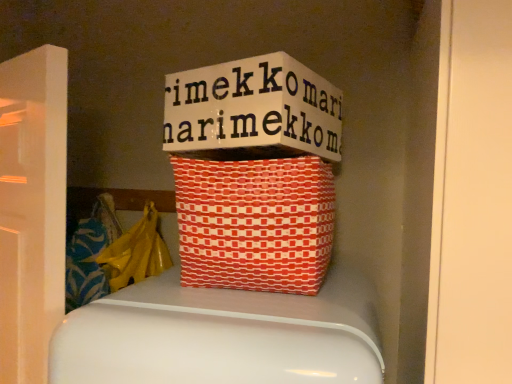
Measure the distance between yellow plastic bag at left and camera.

They are 1.14 meters apart.

Where is `yellow plastic bag at left`? This screenshot has width=512, height=384. yellow plastic bag at left is located at coordinates (136, 252).

What do you see at coordinates (136, 252) in the screenshot? I see `yellow plastic bag at left` at bounding box center [136, 252].

Describe the element at coordinates (255, 223) in the screenshot. I see `red woven basket at center` at that location.

At what (x,y) coordinates should I click in order to perform the action: click on red woven basket at center. Please return your answer as a coordinate pair (x, y). Image resolution: width=512 pixels, height=384 pixels. Looking at the image, I should click on (255, 223).

Consider the image. What is the approximate height of red woven basket at center?

red woven basket at center is 10.65 inches in height.

This screenshot has height=384, width=512. In order to click on yellow plastic bag at left in this screenshot , I will do `click(136, 252)`.

Considering the positions of objects yellow plastic bag at left and red woven basket at center in the image provided, who is more to the right, yellow plastic bag at left or red woven basket at center?

red woven basket at center.

Considering the positions of objects yellow plastic bag at left and red woven basket at center in the image provided, who is behind, yellow plastic bag at left or red woven basket at center?

Positioned behind is yellow plastic bag at left.

Considering the positions of point (170, 260) and point (185, 197), is point (170, 260) closer or farther from the camera than point (185, 197)?

Point (170, 260) appears to be farther away from the viewer than point (185, 197).

From the image's perspective, is yellow plastic bag at left located beneath red woven basket at center?

Yes, from the image's perspective, yellow plastic bag at left is beneath red woven basket at center.

From a real-world perspective, is yellow plastic bag at left beneath red woven basket at center?

Correct, in the physical world, yellow plastic bag at left is lower than red woven basket at center.

Which object is wider, yellow plastic bag at left or red woven basket at center?

Wider between the two is red woven basket at center.

Who is shorter, yellow plastic bag at left or red woven basket at center?

Standing shorter between the two is red woven basket at center.

Is yellow plastic bag at left smaller than red woven basket at center?

Indeed, yellow plastic bag at left has a smaller size compared to red woven basket at center.

Is yellow plastic bag at left completely or partially outside of red woven basket at center?

Yes, yellow plastic bag at left is located beyond the bounds of red woven basket at center.

Is yellow plastic bag at left in contact with red woven basket at center?

yellow plastic bag at left and red woven basket at center are not in contact.

Is yellow plastic bag at left oriented towards red woven basket at center?

No, yellow plastic bag at left is not turned towards red woven basket at center.

This screenshot has width=512, height=384. Identify the location of basket on the right of yellow plastic bag at left. (255, 223).

Which is more to the right, red woven basket at center or yellow plastic bag at left?

red woven basket at center.

Consider the image. Does red woven basket at center lie in front of yellow plastic bag at left?

Yes, the depth of red woven basket at center is less than that of yellow plastic bag at left.

Which is closer, (307, 226) or (138, 273)?

Point (307, 226) appears to be closer to the viewer than point (138, 273).

From the image's perspective, is red woven basket at center below yellow plastic bag at left?

No, from the image's perspective, red woven basket at center is not beneath yellow plastic bag at left.

From a real-world perspective, is red woven basket at center below yellow plastic bag at left?

Incorrect, from a real-world perspective, red woven basket at center is higher than yellow plastic bag at left.

Considering the relative sizes of red woven basket at center and yellow plastic bag at left in the image provided, is red woven basket at center wider than yellow plastic bag at left?

Indeed, red woven basket at center has a greater width compared to yellow plastic bag at left.

Does red woven basket at center have a greater height compared to yellow plastic bag at left?

Incorrect, the height of red woven basket at center is not larger of that of yellow plastic bag at left.

In terms of size, does red woven basket at center appear bigger or smaller than yellow plastic bag at left?

Considering their sizes, red woven basket at center takes up more space than yellow plastic bag at left.

Is red woven basket at center not within yellow plastic bag at left?

red woven basket at center lies outside yellow plastic bag at left's area.

Is red woven basket at center touching yellow plastic bag at left?

red woven basket at center is not next to yellow plastic bag at left, and they're not touching.

Is red woven basket at center oriented away from yellow plastic bag at left?

No, red woven basket at center is not facing the opposite direction of yellow plastic bag at left.

Can you tell me how much red woven basket at center and yellow plastic bag at left differ in facing direction?

The angular difference between red woven basket at center and yellow plastic bag at left is 2.63 degrees.

Image resolution: width=512 pixels, height=384 pixels. Find the location of `basket that is above the yellow plastic bag at left (from a real-world perspective)`. basket that is above the yellow plastic bag at left (from a real-world perspective) is located at coordinates (255, 223).

Locate an element on the screen. This screenshot has height=384, width=512. material behind the red woven basket at center is located at coordinates (136, 252).

Where is `basket located above the yellow plastic bag at left (from the image's perspective)`? basket located above the yellow plastic bag at left (from the image's perspective) is located at coordinates (255, 223).